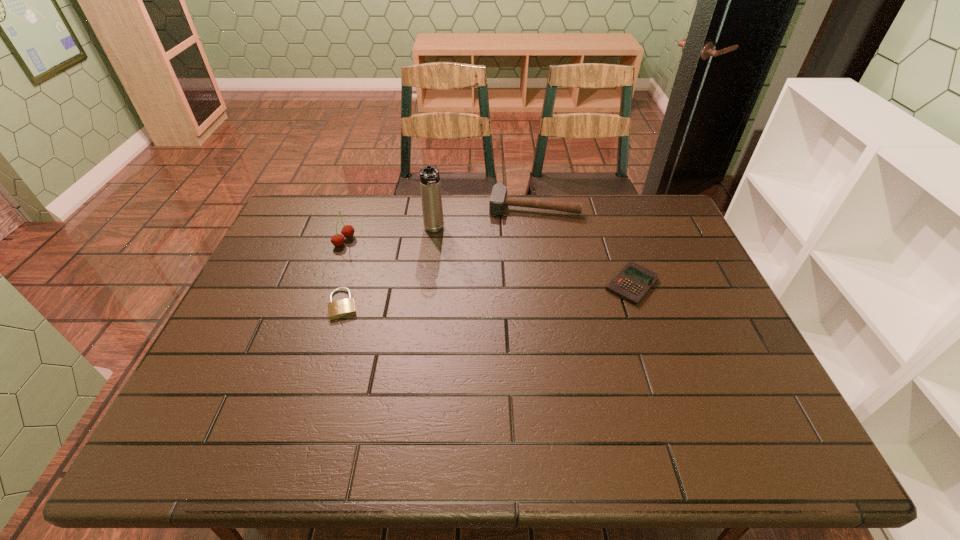
The image size is (960, 540). Identify the location of vacant area in the image that satisfies the following two spatial constraints: 1. on the back side of the cherry; 2. on the right side of the third tallest object. (356, 206).

Locate an element on the screen. Image resolution: width=960 pixels, height=540 pixels. free point that satisfies the following two spatial constraints: 1. on the back side of the second tallest object; 2. on the right side of the fourth object from left to right is located at coordinates (356, 206).

You are a GUI agent. You are given a task and a screenshot of the screen. Output one action in this format:
    pyautogui.click(x=<x>, y=<y>)
    Task: Click on the vacant space that satisfies the following two spatial constraints: 1. on the back side of the cherry; 2. on the right side of the thermos bottle
    
    Given the screenshot: What is the action you would take?
    pyautogui.click(x=348, y=230)